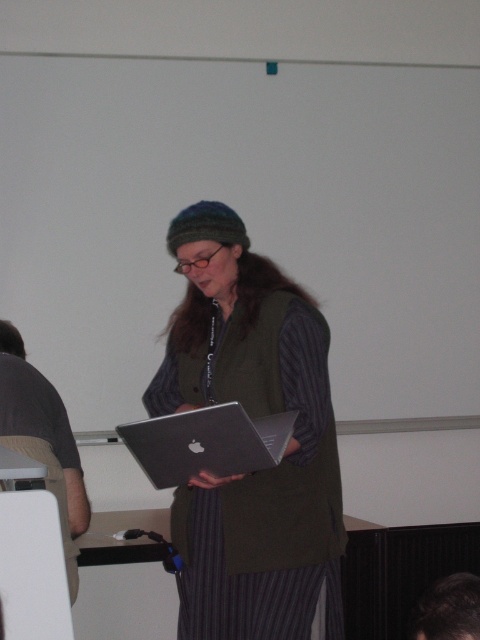
Between point (282, 404) and point (66, 531), which one is positioned behind?

Point (282, 404)

At what (x,y) coordinates should I click in order to perform the action: click on matte silver laptop at center. Please return your answer as a coordinate pair (x, y). Looking at the image, I should click on (251, 413).

Locate an element on the screen. The height and width of the screenshot is (640, 480). matte silver laptop at center is located at coordinates (251, 413).

Between silver metallic laptop at center and gray fabric shirt at left, which one has more height?

With more height is gray fabric shirt at left.

Is point (252, 458) more distant than point (54, 454)?

No, (252, 458) is in front of (54, 454).

Where is `silver metallic laptop at center`? silver metallic laptop at center is located at coordinates (206, 442).

Between point (277, 291) and point (427, 632), which one is positioned behind?

Point (277, 291)

Does matte silver laptop at center have a lesser height compared to dark hair at lower right?

Incorrect, matte silver laptop at center's height does not fall short of dark hair at lower right's.

The height and width of the screenshot is (640, 480). Describe the element at coordinates (251, 413) in the screenshot. I see `matte silver laptop at center` at that location.

Image resolution: width=480 pixels, height=640 pixels. Identify the location of matte silver laptop at center. (251, 413).